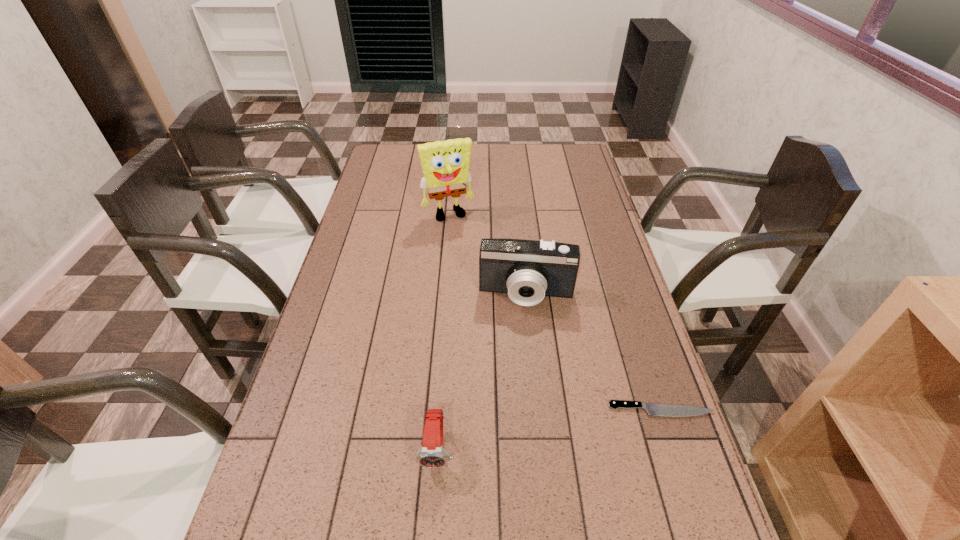
Select which object is the third closest to the second shortest object. Please provide its 2D coordinates. Your answer should be formatted as a tuple, i.e. [(x, y)], where the tuple contains the x and y coordinates of a point satisfying the conditions above.

[(445, 164)]

At what (x,y) coordinates should I click in order to perform the action: click on vacant space that satisfies the following two spatial constraints: 1. on the front side of the camcorder; 2. on the left side of the sponge. Please return your answer as a coordinate pair (x, y). Looking at the image, I should click on (442, 295).

This screenshot has height=540, width=960. Identify the location of free location that satisfies the following two spatial constraints: 1. on the front side of the farthest object; 2. on the right side of the steak knife. (431, 410).

What are the coordinates of `vacant space that satisfies the following two spatial constraints: 1. on the front side of the sponge; 2. on the right side of the rightmost object` in the screenshot? It's located at (431, 410).